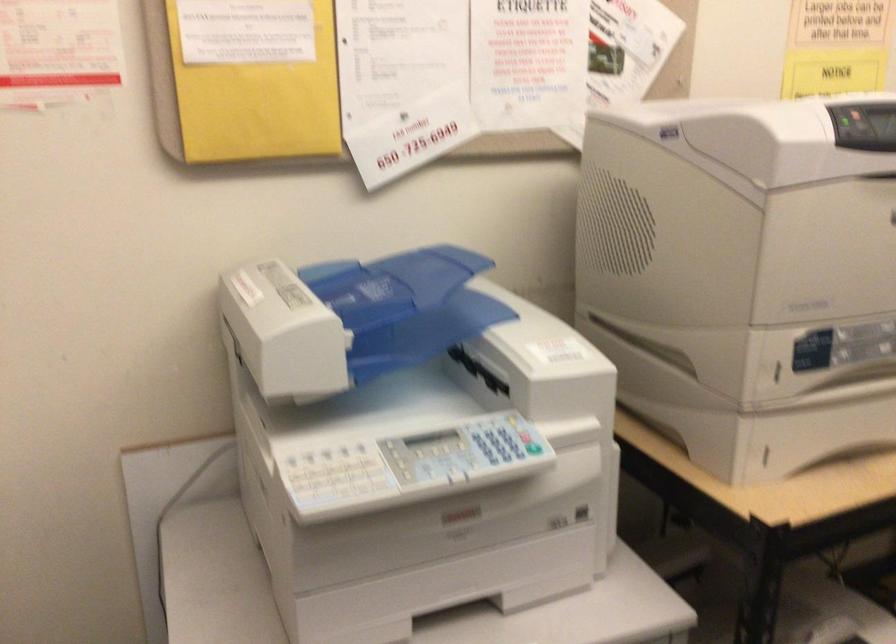
In order to click on paper tray handle in this screenshot , I will do `click(777, 372)`.